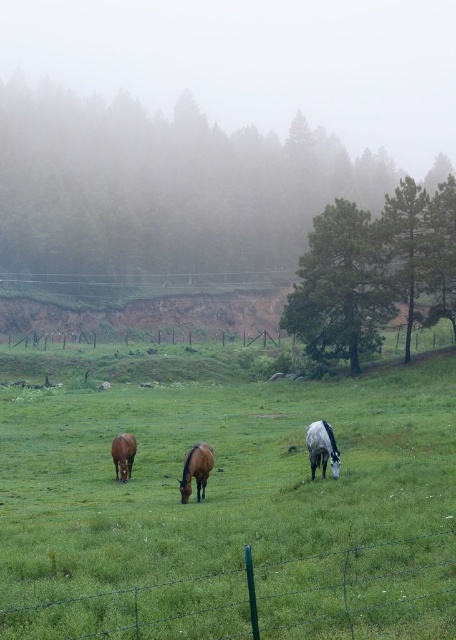
Can you confirm if green wire fence at lower center is taller than brown glossy horse at center?

No, green wire fence at lower center is not taller than brown glossy horse at center.

Who is more forward, (233, 570) or (197, 483)?

Point (233, 570) is in front.

Find the location of a particular element. This screenshot has width=456, height=640. green wire fence at lower center is located at coordinates (262, 596).

Which is more to the right, brown glossy horse at center or brown glossy horse at lower left?

Positioned to the right is brown glossy horse at center.

Who is taller, brown glossy horse at center or brown glossy horse at lower left?

With more height is brown glossy horse at center.

Is point (191, 472) closer to camera compared to point (129, 452)?

Yes.

The width and height of the screenshot is (456, 640). Identify the location of brown glossy horse at center. (196, 470).

Can you confirm if white glossy horse at center is taller than brown glossy horse at center?

Indeed, white glossy horse at center has a greater height compared to brown glossy horse at center.

Between point (324, 461) and point (191, 468), which one is positioned behind?

Positioned behind is point (324, 461).

Where is `white glossy horse at center`? This screenshot has height=640, width=456. white glossy horse at center is located at coordinates (321, 449).